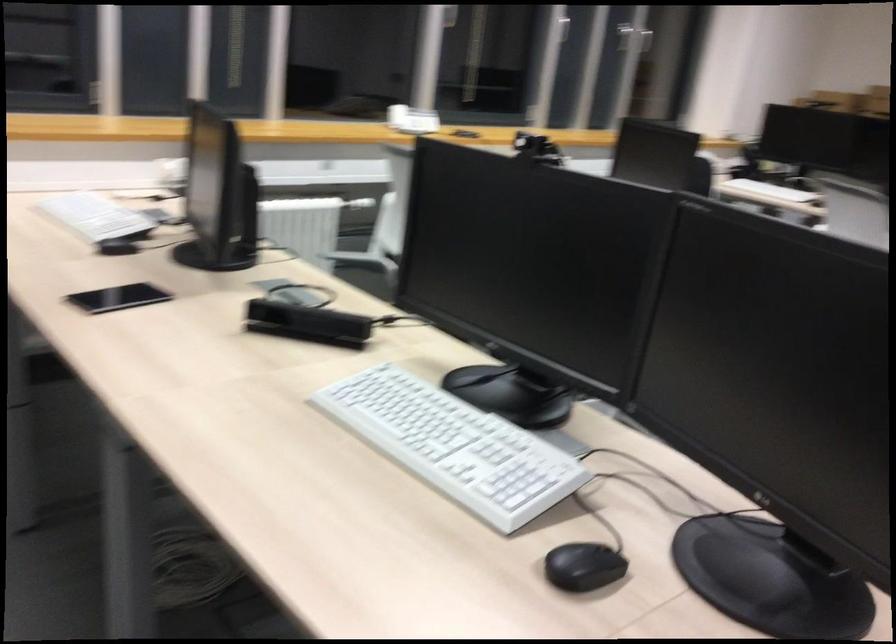
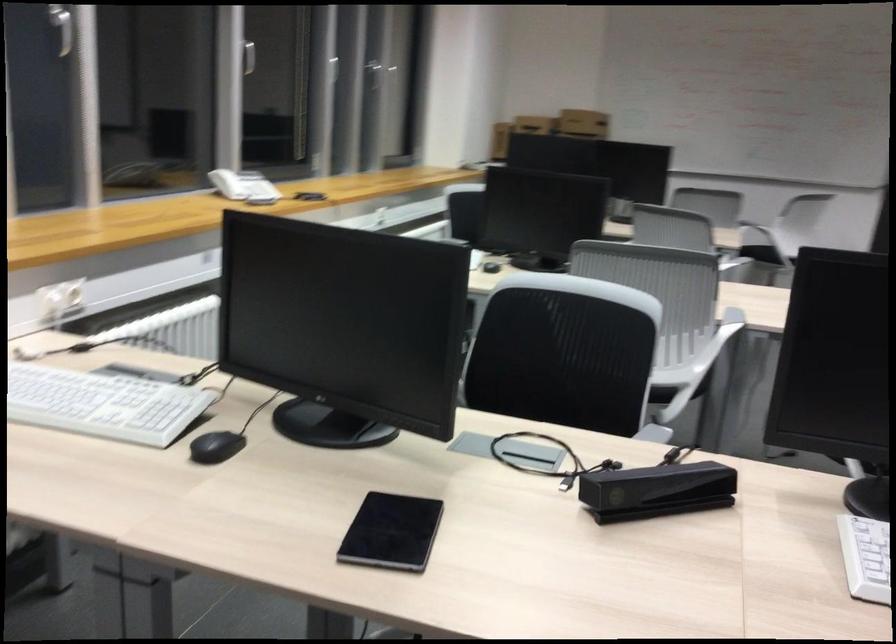
In the second image, find the point that corresponds to (x=394, y=111) in the first image.

(227, 184)